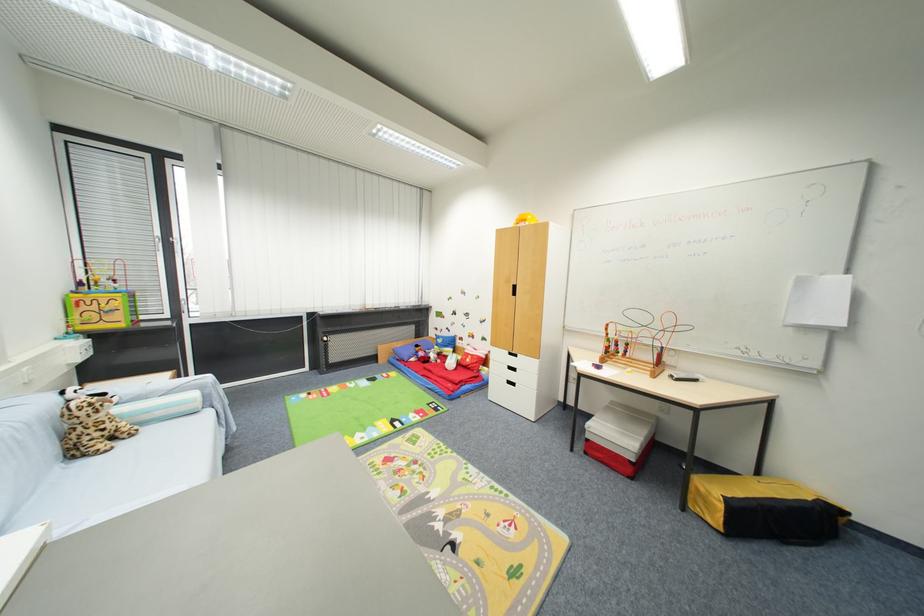
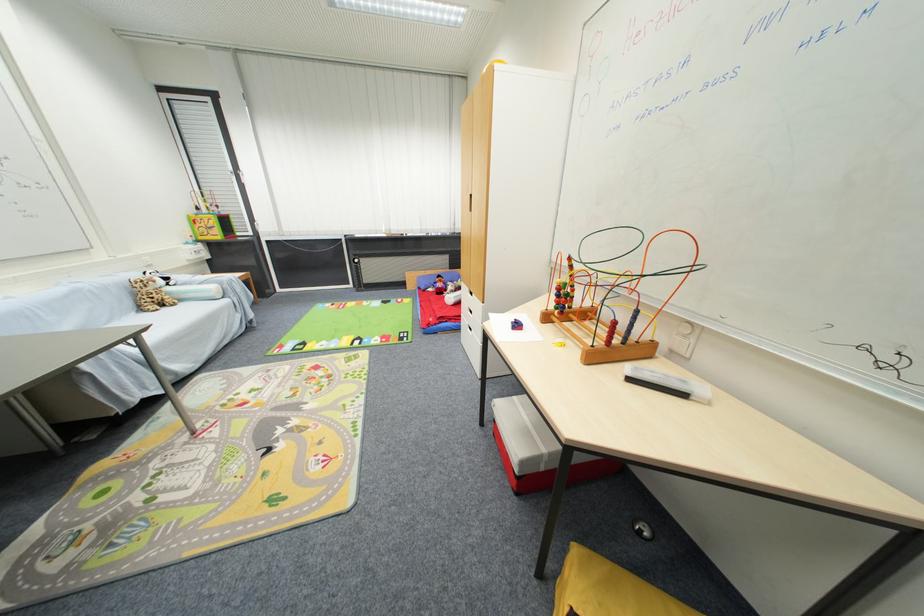
In the second image, find the point that corresponds to the point at 125,446 in the first image.

(171, 310)